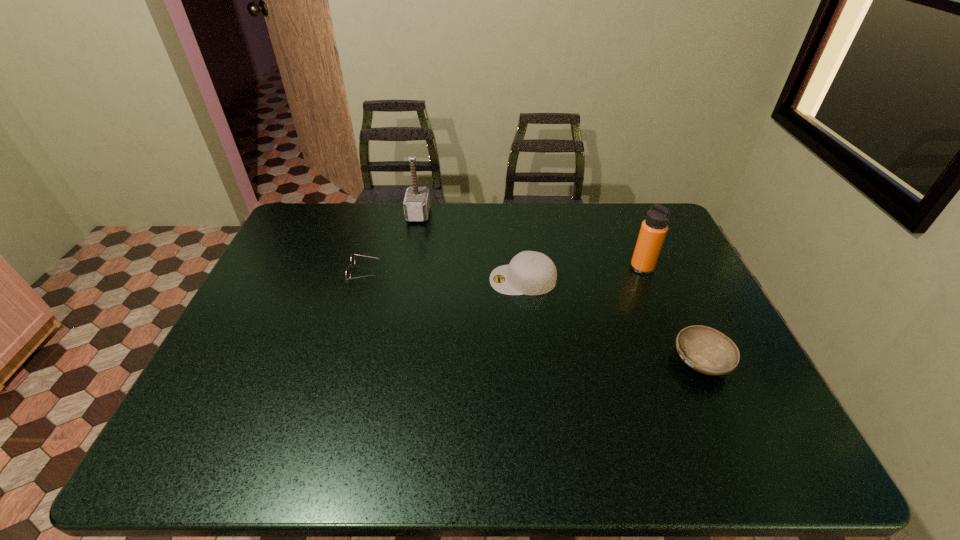
The height and width of the screenshot is (540, 960). What are the coordinates of `free area in between the thermos bottle and the hammer` in the screenshot? It's located at (530, 241).

Where is `free spot between the third tallest object and the bowl`? This screenshot has width=960, height=540. free spot between the third tallest object and the bowl is located at coordinates (612, 321).

Locate an element on the screen. free space between the bowl and the farthest object is located at coordinates (560, 288).

Locate an element on the screen. unoccupied area between the cap and the farthest object is located at coordinates (470, 247).

The height and width of the screenshot is (540, 960). I want to click on empty space that is in between the bowl and the thermos bottle, so click(x=671, y=315).

Identify which object is the second nearest to the bowl. Please provide its 2D coordinates. Your answer should be formatted as a tuple, i.e. [(x, y)], where the tuple contains the x and y coordinates of a point satisfying the conditions above.

[(531, 273)]

Locate which object is the closest to the thermos bottle. Please provide its 2D coordinates. Your answer should be formatted as a tuple, i.e. [(x, y)], where the tuple contains the x and y coordinates of a point satisfying the conditions above.

[(531, 273)]

This screenshot has height=540, width=960. Identify the location of free space that satisfies the following two spatial constraints: 1. for striking with the head of the fourth tallest object; 2. on the left side of the farthest object. (392, 361).

What are the coordinates of `vacant space that satisfies the following two spatial constraints: 1. on the front-facing side of the bowl; 2. on the left side of the third object from right to left` in the screenshot? It's located at (532, 361).

The height and width of the screenshot is (540, 960). Find the location of `vacant space that satisfies the following two spatial constraints: 1. on the back side of the nearest object; 2. on the front-facing side of the shortest object`. vacant space that satisfies the following two spatial constraints: 1. on the back side of the nearest object; 2. on the front-facing side of the shortest object is located at coordinates (660, 273).